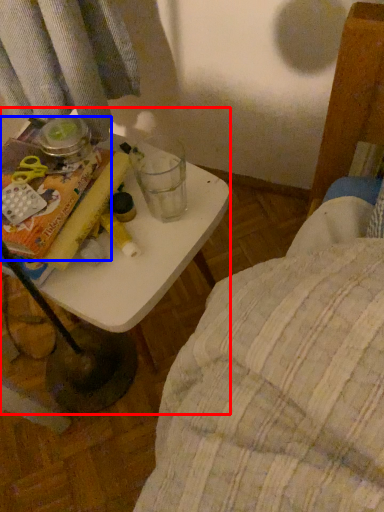
Question: Which of the following is the closest to the observer, table (highlighted by a red box) or paperback book (highlighted by a blue box)?

Choices:
 (A) table
 (B) paperback book

Answer: (B)